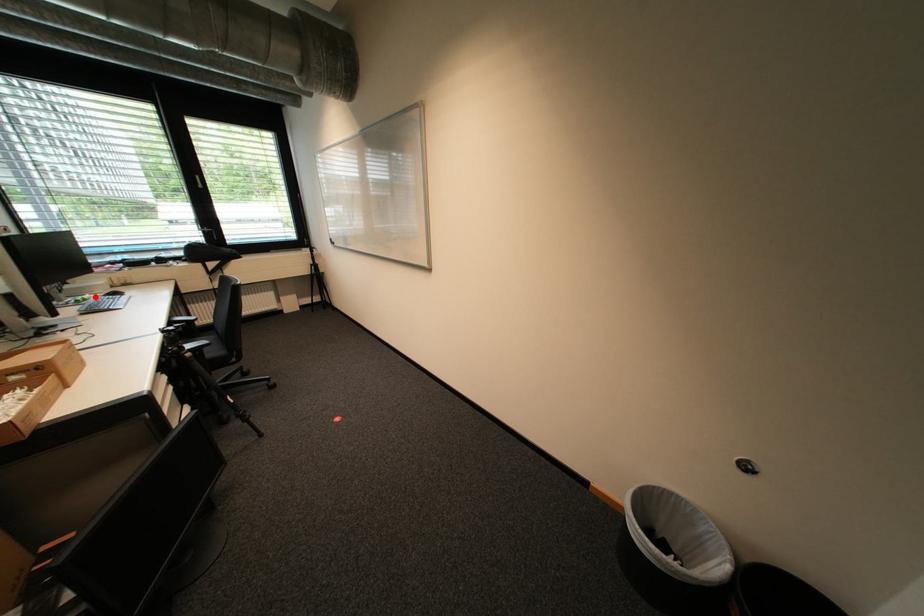
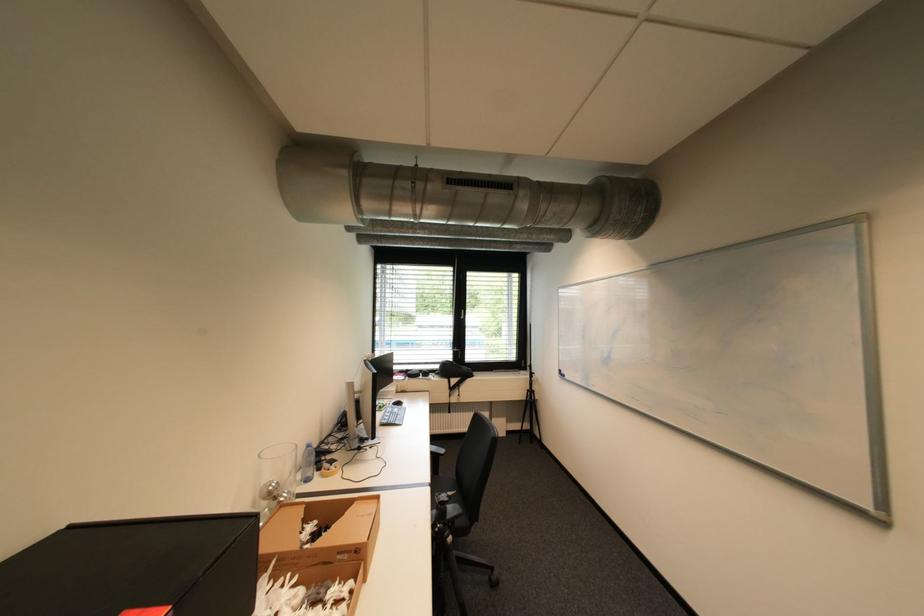
Find the pixel in the second image that matches the highlighted location in the first image.

(393, 403)